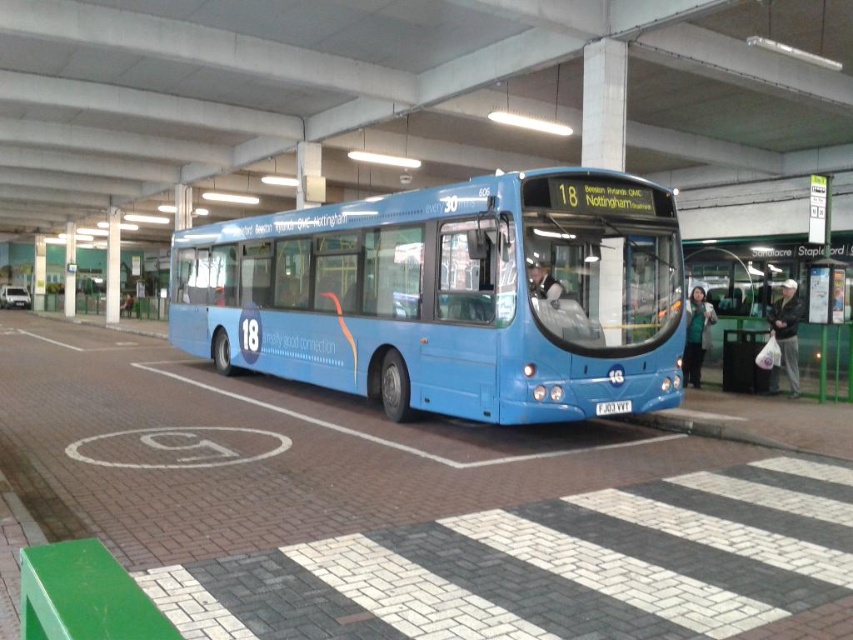
Question: Does matte blue bus at center come in front of green plastic bus stop at center?

Choices:
 (A) no
 (B) yes

Answer: (B)

Question: Can you confirm if matte blue bus at center is positioned to the left of green plastic bus stop at center?

Choices:
 (A) yes
 (B) no

Answer: (A)

Question: Which point appears closest to the camera in this image?

Choices:
 (A) (401, 262)
 (B) (796, 241)

Answer: (A)

Question: Can you confirm if matte blue bus at center is bigger than green plastic bus stop at center?

Choices:
 (A) no
 (B) yes

Answer: (B)

Question: Which point is closer to the camera taking this photo?

Choices:
 (A) (456, 211)
 (B) (769, 252)

Answer: (A)